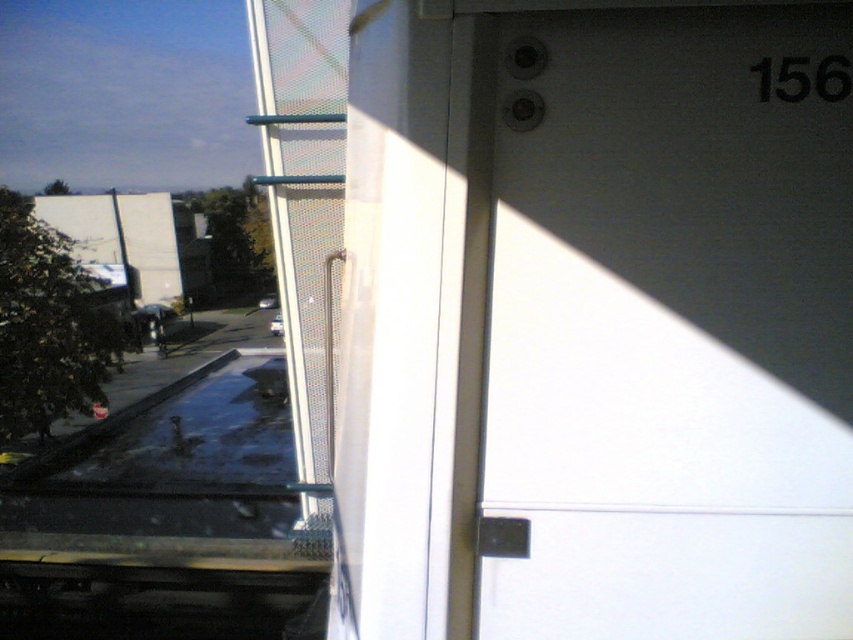
Consider the image. You are a passenger on a bus and you see the white matte door at upper right and the transparent glass pool at lower left. Which object is located to the right of the other?

The white matte door at upper right is positioned on the right side of transparent glass pool at lower left.